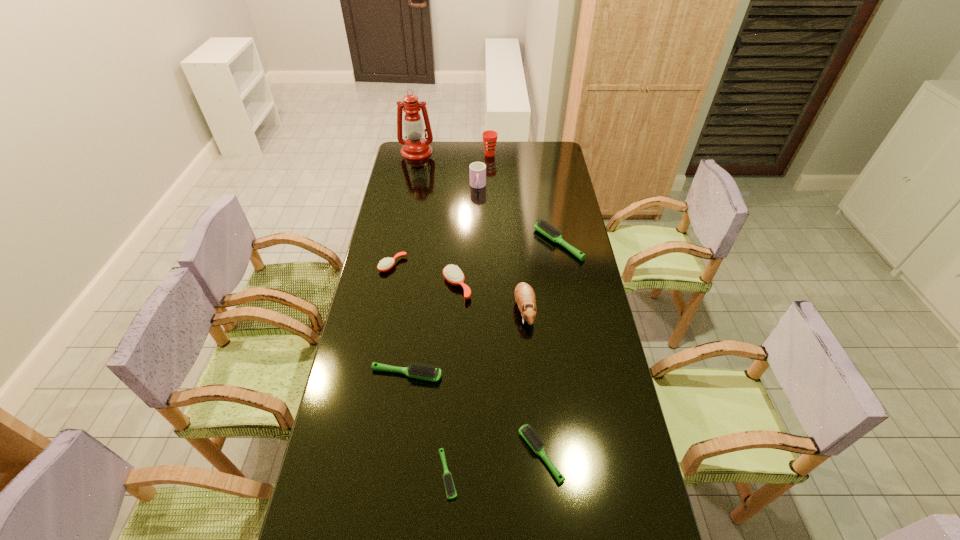
Locate an element on the screen. This screenshot has height=540, width=960. the tallest object is located at coordinates (415, 147).

In order to click on the farther cup in this screenshot , I will do `click(489, 137)`.

Identify the location of the eighth nearest object. The image size is (960, 540). (477, 169).

The width and height of the screenshot is (960, 540). In order to click on brown hamster in this screenshot , I will do `click(525, 298)`.

Where is `the bigger orange hairbrush`? Image resolution: width=960 pixels, height=540 pixels. the bigger orange hairbrush is located at coordinates (453, 274).

At what (x,y) coordinates should I click in order to perform the action: click on the rightmost hairbrush. Please return your answer as a coordinate pair (x, y). This screenshot has height=540, width=960. Looking at the image, I should click on (541, 226).

In order to click on the biggest light hairbrush in this screenshot , I will do `click(541, 226)`.

Image resolution: width=960 pixels, height=540 pixels. Identify the location of the leftmost light hairbrush. (429, 373).

Locate an element on the screen. This screenshot has width=960, height=540. the second biggest light hairbrush is located at coordinates tap(429, 373).

At what (x,y) coordinates should I click in order to perform the action: click on the smaller orange hairbrush. Please return your answer as a coordinate pair (x, y). Looking at the image, I should click on (385, 264).